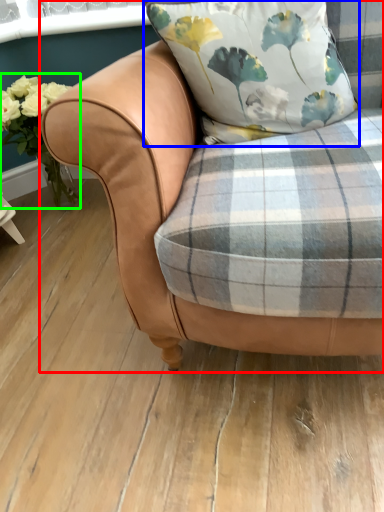
Question: Which object is positioned farthest from chair (highlighted by a red box)? Select from pillow (highlighted by a blue box) and floral arrangement (highlighted by a green box).

Choices:
 (A) pillow
 (B) floral arrangement

Answer: (B)